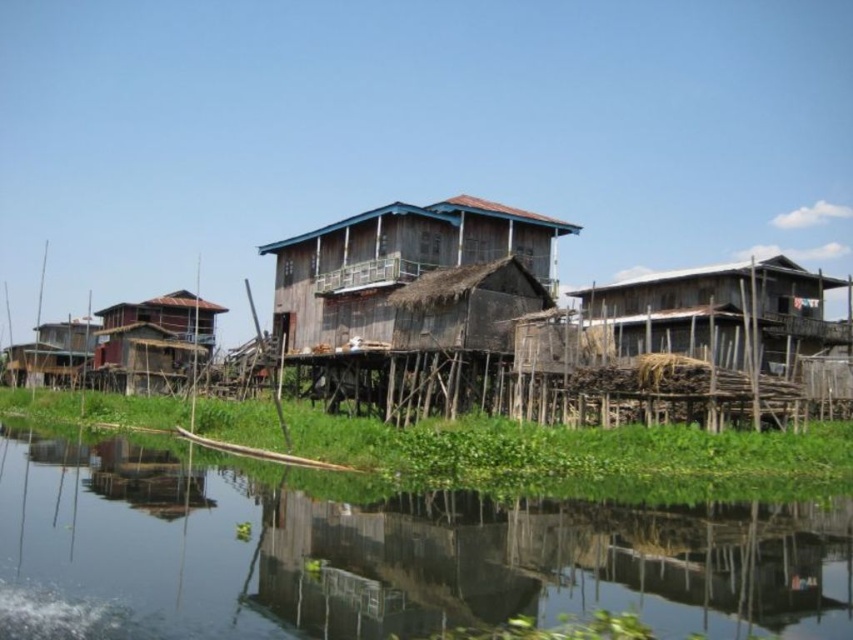
Based on the photo, can you confirm if brown wooden hut at right is positioned below wooden hut at center?

No.

Is brown wooden hut at right above wooden hut at center?

Correct, brown wooden hut at right is located above wooden hut at center.

Is point (740, 340) positioned behind point (169, 317)?

No, it is not.

Where is `brown wooden hut at right`? The height and width of the screenshot is (640, 853). brown wooden hut at right is located at coordinates (718, 312).

Does green grassy river at center appear under weathered wood hut at center?

Yes.

Is point (828, 598) positioned before point (364, 321)?

Yes.

At what (x,y) coordinates should I click in order to perform the action: click on green grassy river at center. Please return your answer as a coordinate pair (x, y). The width and height of the screenshot is (853, 640). Looking at the image, I should click on (380, 554).

Can you confirm if weathered wood houses at center is bigger than brown wooden hut at right?

Indeed, weathered wood houses at center has a larger size compared to brown wooden hut at right.

Is weathered wood houses at center further to camera compared to brown wooden hut at right?

That is False.

Locate an element on the screen. weathered wood houses at center is located at coordinates (527, 316).